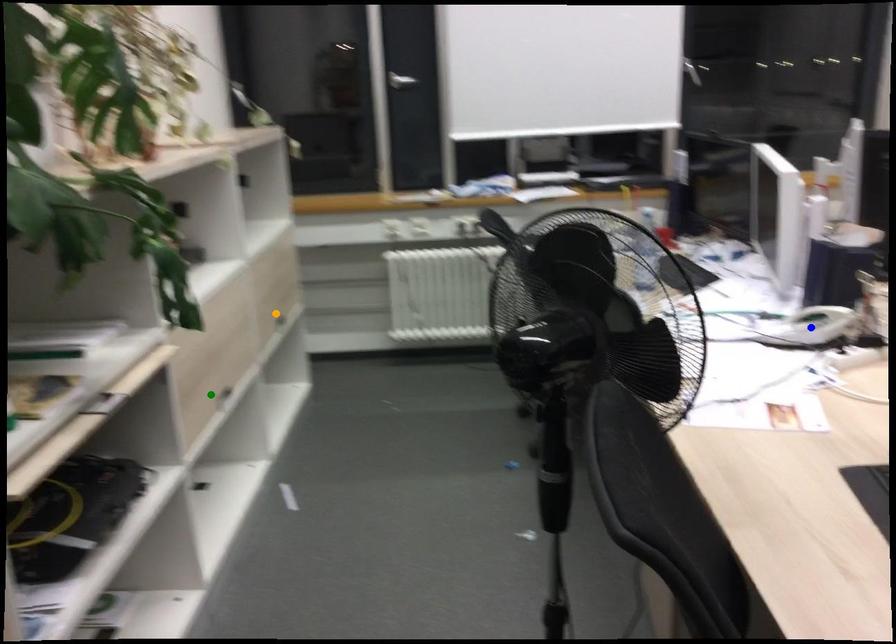
Order these from nearest to farthest:
A) green point
B) blue point
C) orange point

orange point
green point
blue point